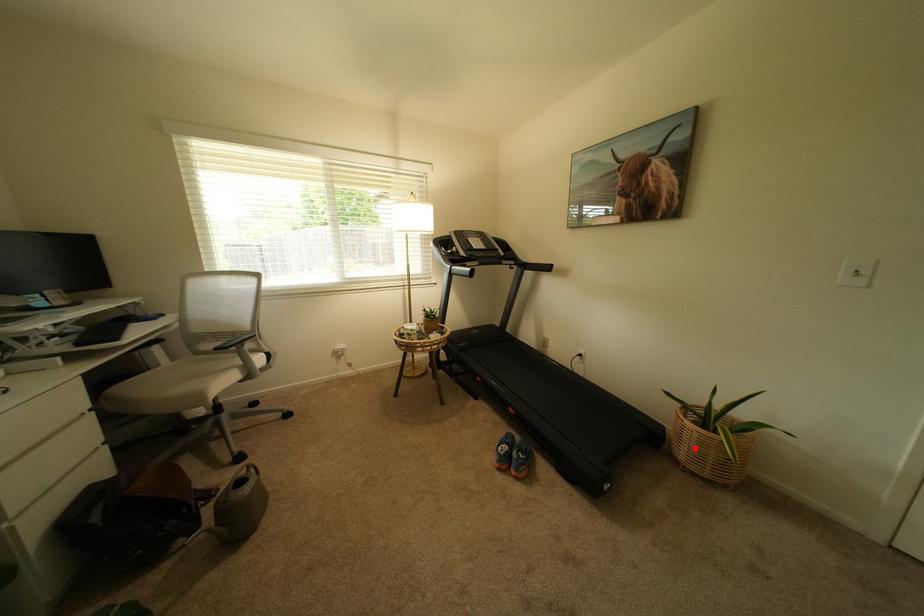
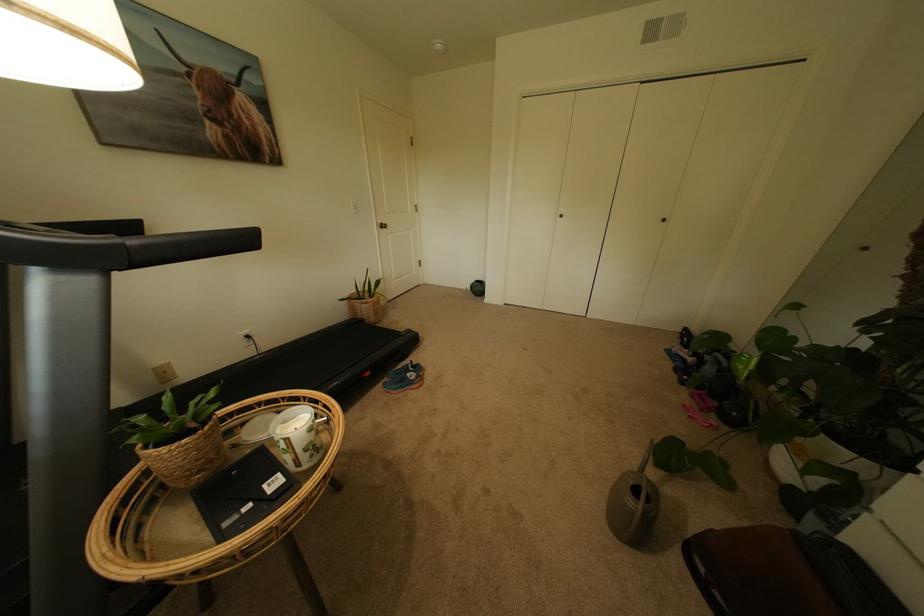
Question: I am providing you with two images of the same scene from different viewpoints. A red point is shown in image1. For the corresponding object point in image2, is it positioned nearer or farther from the camera?

Choices:
 (A) Nearer
 (B) Farther

Answer: (A)